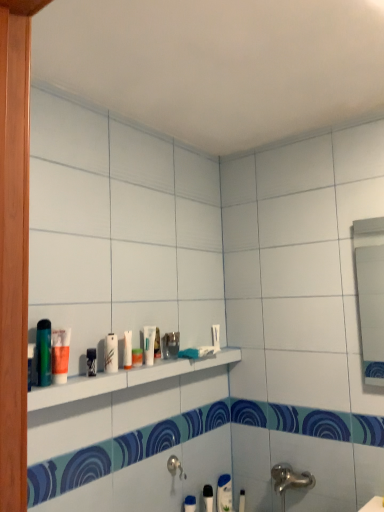
Question: Relative to white matte toothpaste at center, acting as the 1th toothpaste starting from the front, is white glossy tube at center, marked as the 6th toiletry in a bottom-to-top arrangement, in front or behind?

Choices:
 (A) behind
 (B) front

Answer: (B)

Question: Is white glossy tube at center, marked as the 3th toiletry in a front-to-back arrangement, taller or shorter than white matte toothpaste at center, the 2th toothpaste in the right-to-left sequence?

Choices:
 (A) short
 (B) tall

Answer: (B)

Question: Based on their relative distances, which object is nearer to the black plastic razor at center, placed as the 2th toiletry when sorted from front to back?

Choices:
 (A) metallic glass at center, which is counted as the fifth toiletry, starting from the top
 (B) white glossy shelf at center
 (C) black plastic toothbrush at lower center, the 2th toiletry in the bottom-to-top sequence
 (D) white glossy tube at center, which is counted as the third toiletry, starting from the left
 (E) white matte toothpaste at lower right, arranged as the 2th toothpaste when viewed from the top

Answer: (D)

Question: Which is farther from the white matte tube at lower center, placed as the seventh toiletry when sorted from left to right?

Choices:
 (A) white matte toothpaste at lower right, arranged as the 2th toothpaste when viewed from the top
 (B) black plastic razor at center, positioned as the fifth toiletry in bottom-to-top order
 (C) white matte toothpaste at center, positioned as the 1th toothpaste in top-to-bottom order
 (D) metallic glass at center, the fifth toiletry positioned from the left
 (E) translucent plastic cup at shelf left, the seventh toiletry positioned from the right

Answer: (E)